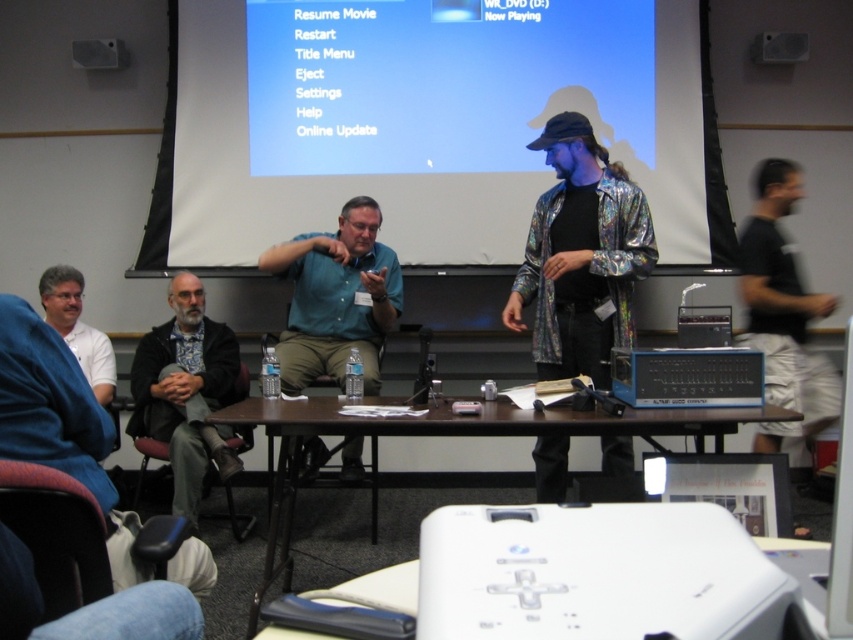
Question: Which object is the farthest from the dark gray fabric jacket at lower left?

Choices:
 (A) brown wooden table at center
 (B) green matte shirt at center

Answer: (A)

Question: Is brown wooden table at center closer to the viewer compared to green matte shirt at center?

Choices:
 (A) yes
 (B) no

Answer: (A)

Question: Can you confirm if white plastic projector at center is positioned to the left of brown wooden table at center?

Choices:
 (A) yes
 (B) no

Answer: (B)

Question: Among these objects, which one is farthest from the camera?

Choices:
 (A) black fabric shorts at right
 (B) white matte projection screen at upper center

Answer: (B)

Question: Which is nearer to the white plastic projector at center?

Choices:
 (A) blue matte projection screen at upper center
 (B) shiny metallic jacket at center
 (C) dark gray fabric jacket at lower left
 (D) green matte shirt at center

Answer: (B)

Question: Does green matte shirt at center appear over dark gray fabric jacket at lower left?

Choices:
 (A) yes
 (B) no

Answer: (A)